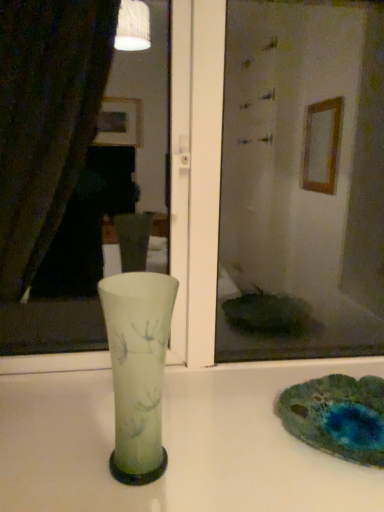
Based on the photo, measure the distance between point [200,200] and camera.

A distance of 34.37 inches exists between point [200,200] and camera.

Identify the location of frosted glass vase at center. This screenshot has height=512, width=384. (138, 369).

The height and width of the screenshot is (512, 384). In order to click on transparent glass mirror at center in this screenshot , I will do `click(196, 174)`.

How distant is frosted glass vase at center from white glossy vase at center?

frosted glass vase at center is 6.96 inches away from white glossy vase at center.

How many degrees apart are the facing directions of frosted glass vase at center and white glossy vase at center?

The facing directions of frosted glass vase at center and white glossy vase at center are 5.97 degrees apart.

Between frosted glass vase at center and white glossy vase at center, which one appears on the right side from the viewer's perspective?

From the viewer's perspective, white glossy vase at center appears more on the right side.

From a real-world perspective, who is located higher, frosted glass vase at center or white glossy vase at center?

frosted glass vase at center, from a real-world perspective.

Looking at their sizes, would you say white glossy vase at center is wider or thinner than transparent glass mirror at center?

In the image, white glossy vase at center appears to be wider than transparent glass mirror at center.

Considering the relative sizes of white glossy vase at center and transparent glass mirror at center in the image provided, is white glossy vase at center smaller than transparent glass mirror at center?

Correct, white glossy vase at center occupies less space than transparent glass mirror at center.

Based on the photo, from the image's perspective, is white glossy vase at center over transparent glass mirror at center?

No, from the image's perspective, white glossy vase at center is not over transparent glass mirror at center.

Would you say white glossy vase at center is a long distance from transparent glass mirror at center?

white glossy vase at center is actually quite close to transparent glass mirror at center.

Locate an element on the screen. mirror positioned vertically above the frosted glass vase at center (from a real-world perspective) is located at coordinates pos(196,174).

From the image's perspective, is transparent glass mirror at center above frosted glass vase at center?

Yes.

From a real-world perspective, does transparent glass mirror at center sit lower than frosted glass vase at center?

Incorrect, from a real-world perspective, transparent glass mirror at center is higher than frosted glass vase at center.

Considering the points (175, 164) and (172, 279), which point is in front, point (175, 164) or point (172, 279)?

The point (172, 279) is closer.

From a real-world perspective, is white glossy vase at center below frosted glass vase at center?

Yes, from a real-world perspective, white glossy vase at center is beneath frosted glass vase at center.

Which is more to the left, white glossy vase at center or frosted glass vase at center?

Positioned to the left is frosted glass vase at center.

From the image's perspective, is white glossy vase at center above frosted glass vase at center?

Incorrect, from the image's perspective, white glossy vase at center is lower than frosted glass vase at center.

Based on the photo, are white glossy vase at center and frosted glass vase at center far apart?

No.

Between frosted glass vase at center and transparent glass mirror at center, which one has more height?

With more height is transparent glass mirror at center.

Considering the positions of point (163, 345) and point (184, 306), is point (163, 345) closer or farther from the camera than point (184, 306)?

Point (163, 345) is closer to the camera than point (184, 306).

Is frosted glass vase at center not within transparent glass mirror at center?

That's correct, frosted glass vase at center is outside of transparent glass mirror at center.

Does transparent glass mirror at center contain white glossy vase at center?

No, white glossy vase at center is not surrounded by transparent glass mirror at center.

Considering the sizes of objects transparent glass mirror at center and white glossy vase at center in the image provided, who is smaller, transparent glass mirror at center or white glossy vase at center?

With smaller size is white glossy vase at center.

Measure the distance between transparent glass mirror at center and white glossy vase at center.

transparent glass mirror at center and white glossy vase at center are 10.07 inches apart.

Is point (183, 192) farther from camera compared to point (292, 439)?

Yes.

Where is `counter top directly beneath the frosted glass vase at center (from a real-world perspective)`? The width and height of the screenshot is (384, 512). counter top directly beneath the frosted glass vase at center (from a real-world perspective) is located at coordinates (176, 444).

Locate an element on the screen. mirror behind the white glossy vase at center is located at coordinates (196, 174).

When comparing their distances from white glossy vase at center, does frosted glass vase at center or transparent glass mirror at center seem further?

transparent glass mirror at center is further to white glossy vase at center.

Estimate the real-world distances between objects in this image. Which object is closer to frosted glass vase at center, white glossy vase at center or transparent glass mirror at center?

white glossy vase at center is closer to frosted glass vase at center.

Based on the photo, when comparing their distances from frosted glass vase at center, does transparent glass mirror at center or white glossy vase at center seem closer?

Among the two, white glossy vase at center is located nearer to frosted glass vase at center.

Which object lies further to the anchor point transparent glass mirror at center, frosted glass vase at center or white glossy vase at center?

frosted glass vase at center is further to transparent glass mirror at center.

Looking at the image, which one is located further to white glossy vase at center, transparent glass mirror at center or frosted glass vase at center?

Among the two, transparent glass mirror at center is located further to white glossy vase at center.

Estimate the real-world distances between objects in this image. Which object is closer to transparent glass mirror at center, white glossy vase at center or frosted glass vase at center?

Among the two, white glossy vase at center is located nearer to transparent glass mirror at center.

Identify the location of vase between transparent glass mirror at center and white glossy vase at center vertically. (138, 369).